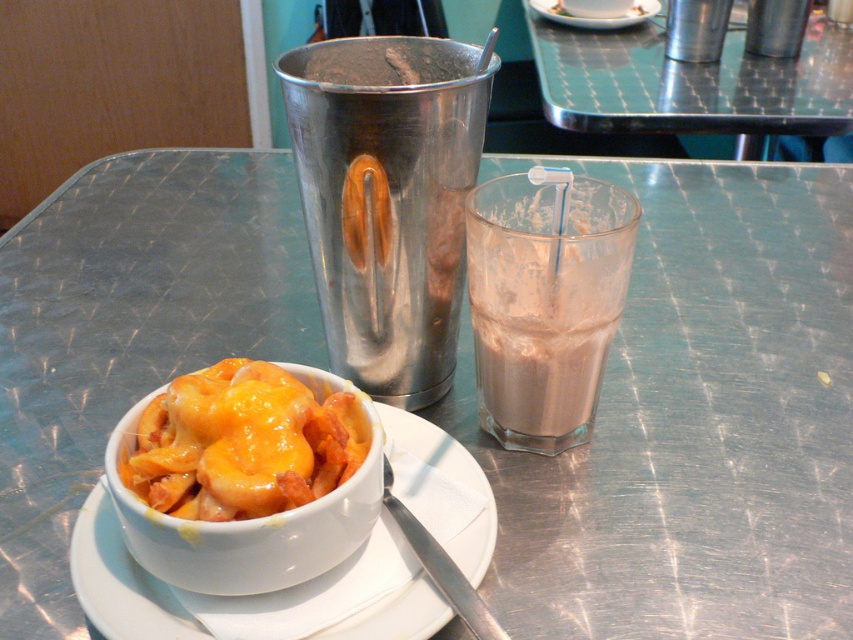
You are a diner customer who wants to place your napkin on the largest available surface near you. Which object should you choose between the brushed metal table at upper center and the white ceramic saucer at lower left?

The brushed metal table at upper center has a larger size compared to the white ceramic saucer at lower left, so you should place your napkin on the brushed metal table at upper center.

You are a customer sitting at the brushed metal table at upper center and want to reach the white ceramic saucer at lower left. Which object is closer to you?

The white ceramic saucer at lower left is closer to you because it is positioned lower and to the left of the brushed metal table at upper center, which is further away.